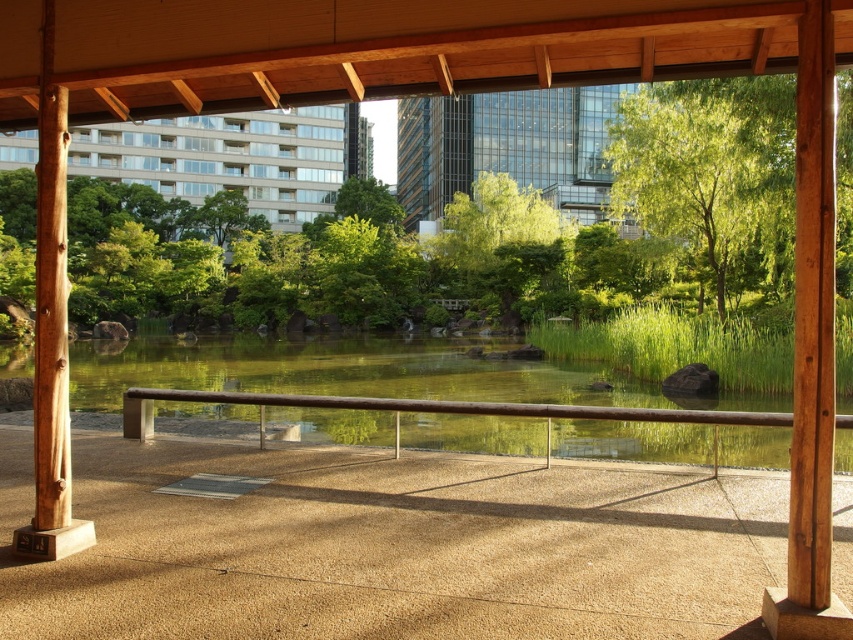
Can you confirm if green leafy tree at upper right is thinner than brown wood rail at center?

No, green leafy tree at upper right is not thinner than brown wood rail at center.

Does green leafy tree at upper right have a lesser height compared to brown wood rail at center?

In fact, green leafy tree at upper right may be taller than brown wood rail at center.

Which is behind, point (654, 176) or point (186, 392)?

The point (654, 176) is behind.

The width and height of the screenshot is (853, 640). I want to click on green leafy tree at upper right, so click(x=712, y=176).